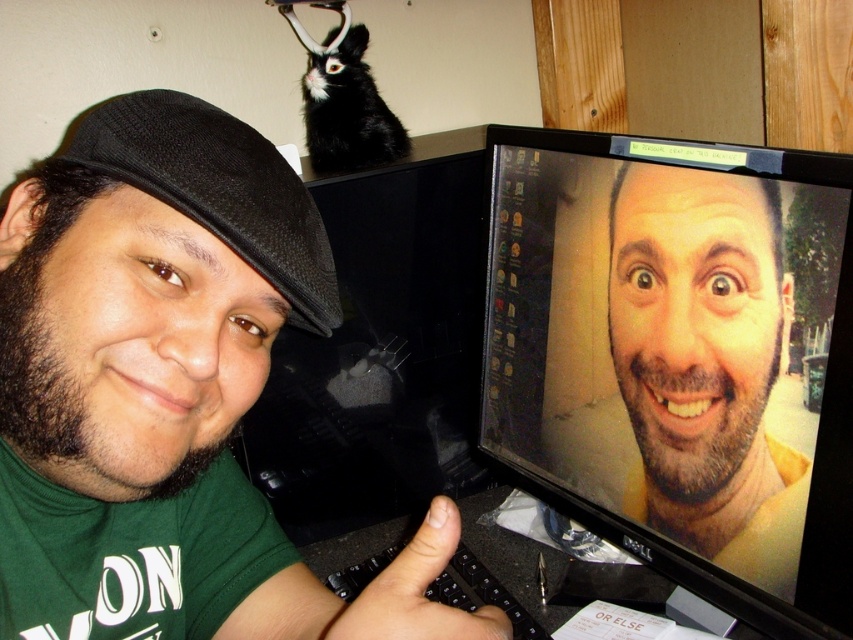
You are standing in front of the computer monitor and want to place a small sticker on the screen. The sticker needs to be placed closer to the camera. Which point should you choose between point (544, 488) and point (57, 272)?

Point (544, 488) is further to the camera than point (57, 272), so you should choose point (544, 488) to place the sticker closer to the camera.

You are a photographer trying to capture a group photo. You have two subjects in front of you, the green matte shirt at left and the smooth skin face at center. Based on their sizes in the current setup, which subject would require more space in the frame to maintain the same level of detail?

The green matte shirt at left requires more space in the frame because its width is larger than the smooth skin face at center.

You are a photographer trying to capture a candid shot of the green matte shirt at left and the black fabric hat at left. Since you can only focus on one subject at a time, which one should you focus on to ensure the other appears in the background?

You should focus on the green matte shirt at left because it is in front of the black fabric hat at left, so the black fabric hat at left will naturally appear in the background.